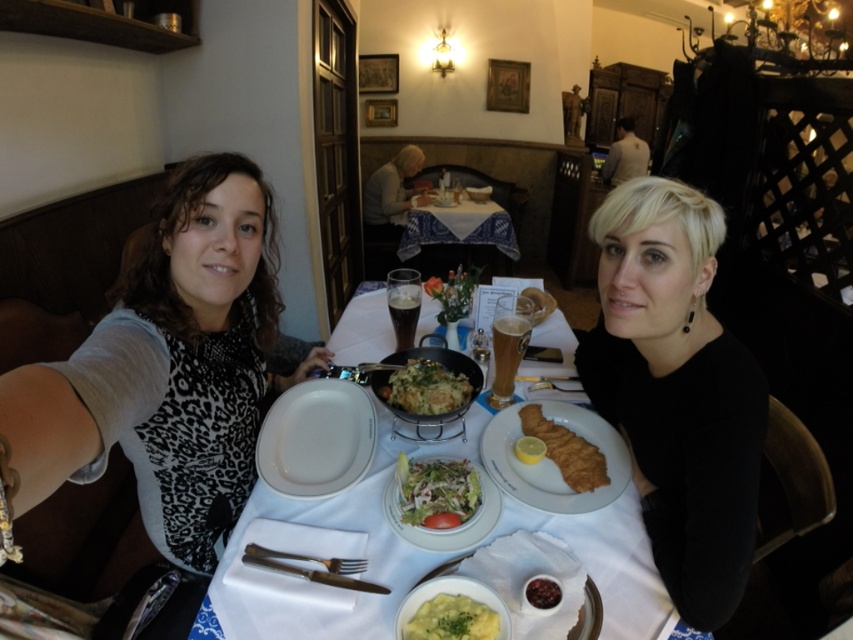
Who is positioned more to the left, white ceramic plate at lower right or white fabric table at center?

white fabric table at center is more to the left.

Who is lower down, white ceramic plate at lower right or white fabric table at center?

white ceramic plate at lower right is lower down.

Does point (547, 401) come behind point (503, 225)?

No, (547, 401) is closer to viewer.

Find the location of a particular element. white ceramic plate at lower right is located at coordinates (550, 461).

Is the position of black matte shirt at center less distant than that of smooth creamy mashed potatoes at center?

No, it is behind smooth creamy mashed potatoes at center.

Which is in front, point (750, 426) or point (474, 632)?

Point (474, 632)

At what (x,y) coordinates should I click in order to perform the action: click on black matte shirt at center. Please return your answer as a coordinate pair (x, y). The image size is (853, 640). Looking at the image, I should click on (676, 390).

Does black matte shirt at center have a greater width compared to dark chocolate bar at center?

Yes, black matte shirt at center is wider than dark chocolate bar at center.

Can you confirm if black matte shirt at center is positioned above dark chocolate bar at center?

Yes.

Locate an element on the screen. black matte shirt at center is located at coordinates (676, 390).

You are a GUI agent. You are given a task and a screenshot of the screen. Output one action in this format:
    pyautogui.click(x=<x>, y=<y>)
    Task: Click on the black matte shirt at center
    The height and width of the screenshot is (640, 853).
    Given the screenshot: What is the action you would take?
    [676, 390]